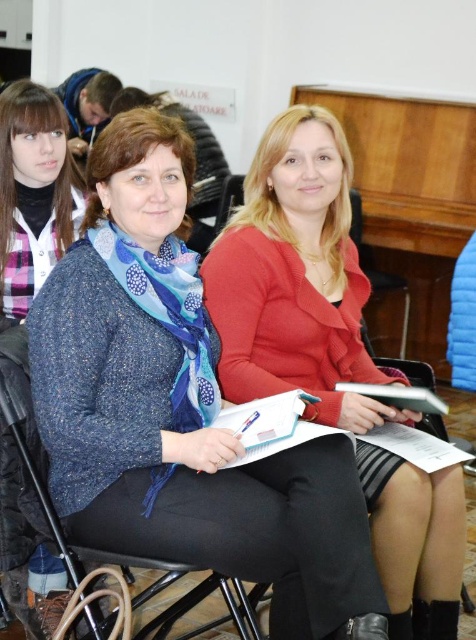
You are an interior designer observing the scene. You need to place a small decorative item on the wooden at center so that it doesn not block the blue textured scarf at center. Where should you place it?

The blue textured scarf at center is above the wooden at center, so placing the decorative item below the wooden at center would ensure it does not block the scarf.

You are organizing a photo shoot and need to ensure that all items in the frame are visible. Given the blue textured scarf at center and the wooden at center, which item takes up more space in the image?

The wooden at center takes up more space than the blue textured scarf at center.